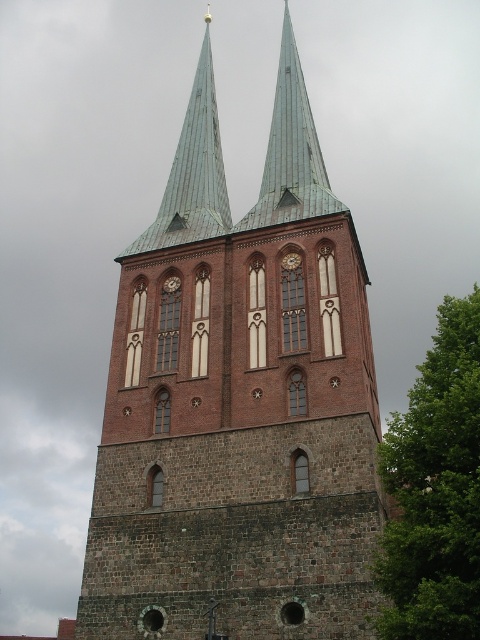
Question: Can you confirm if green copper spire at upper center is positioned below green copper spire at center?

Choices:
 (A) yes
 (B) no

Answer: (A)

Question: Can you confirm if brick tower at center is positioned above green leafy tree at right?

Choices:
 (A) no
 (B) yes

Answer: (B)

Question: Which point is farther from the camera taking this photo?

Choices:
 (A) (304, 147)
 (B) (165, 227)

Answer: (A)

Question: Does brick tower at center appear on the right side of green copper spire at center?

Choices:
 (A) no
 (B) yes

Answer: (A)

Question: Among these points, which one is farthest from the camera?

Choices:
 (A) (212, 72)
 (B) (210, 330)
 (C) (283, 77)

Answer: (A)

Question: Among these points, which one is nearest to the camera?

Choices:
 (A) (296, 65)
 (B) (441, 467)

Answer: (B)